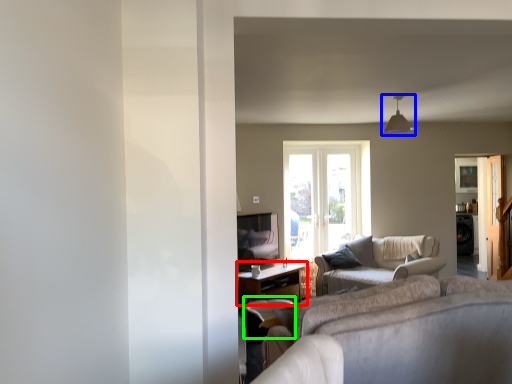
Question: Which object is positioned closest to table (highlighted by a red box)? Select from light fixture (highlighted by a blue box) and swivel chair (highlighted by a green box).

Choices:
 (A) light fixture
 (B) swivel chair

Answer: (B)